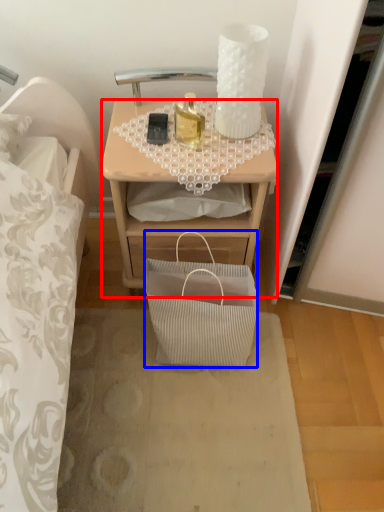
Question: Which object is closer to the camera taking this photo, desk (highlighted by a red box) or handbag (highlighted by a blue box)?

Choices:
 (A) desk
 (B) handbag

Answer: (B)